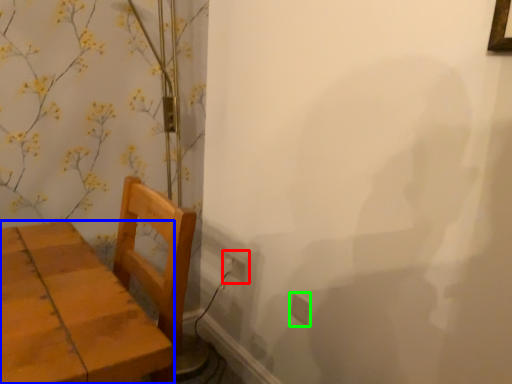
Question: Based on their relative distances, which object is farther from electric outlet (highlighted by a red box)? Choose from furniture (highlighted by a blue box) and electric outlet (highlighted by a green box).

Choices:
 (A) furniture
 (B) electric outlet

Answer: (A)